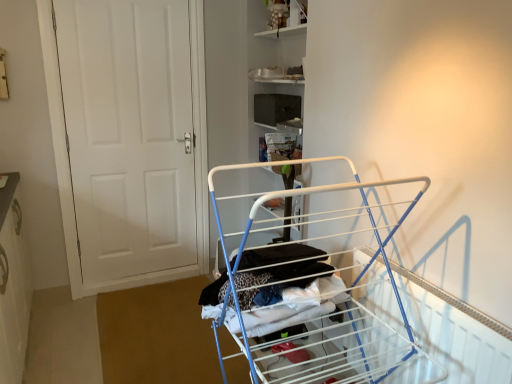
Question: From their relative heights in the image, would you say white matte door at left is taller or shorter than white metal drying rack at center?

Choices:
 (A) tall
 (B) short

Answer: (A)

Question: Would you say white matte door at left is inside or outside white metal drying rack at center?

Choices:
 (A) outside
 (B) inside

Answer: (A)

Question: Considering the real-world distances, which object is farthest from the white matte door at left?

Choices:
 (A) metallic silver shelf at upper center
 (B) white metal drying rack at center

Answer: (B)

Question: Which object is positioned farthest from the white metal drying rack at center?

Choices:
 (A) white matte door at left
 (B) metallic silver shelf at upper center

Answer: (B)